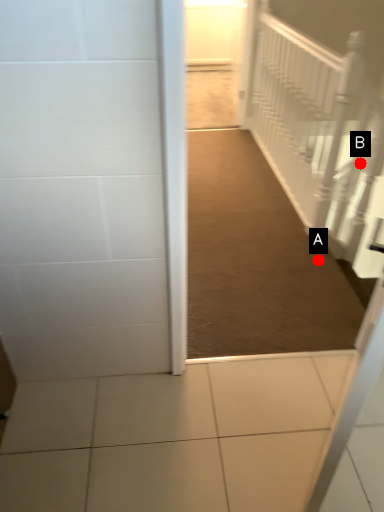
Question: Two points are circled on the image, labeled by A and B beside each circle. Among these points, which one is nearest to the camera?

Choices:
 (A) A is closer
 (B) B is closer

Answer: (A)